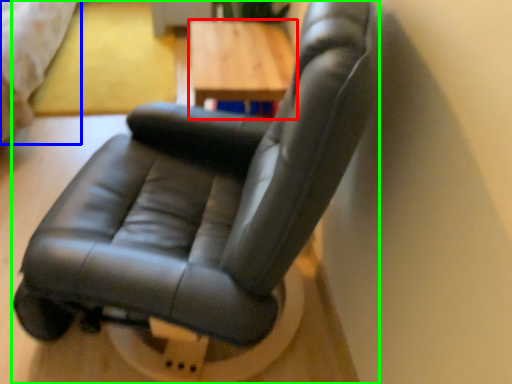
Question: Which is farther away from table (highlighted by a red box)? bed (highlighted by a blue box) or chair (highlighted by a green box)?

Choices:
 (A) bed
 (B) chair

Answer: (A)